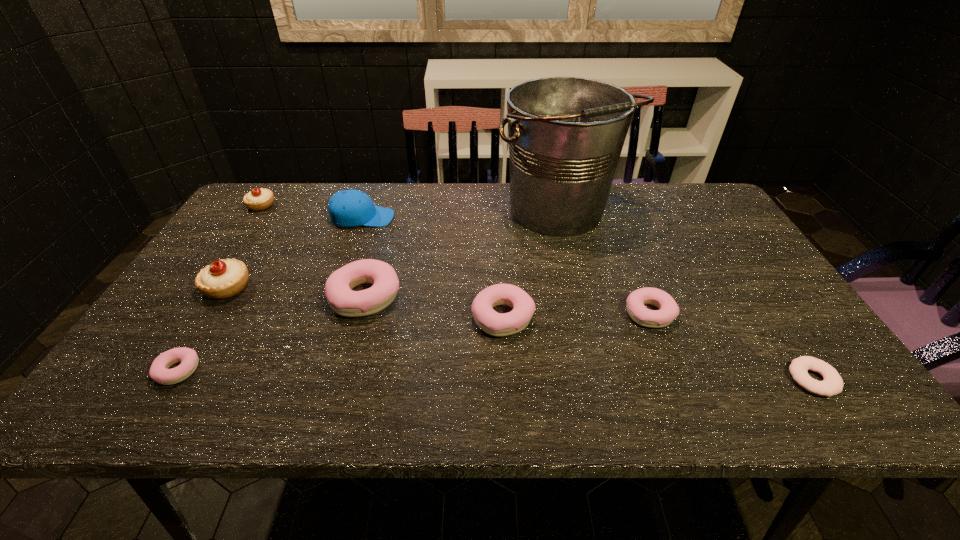
At what (x,y) coordinates should I click in order to perform the action: click on blank space that satisfies the following two spatial constraints: 1. on the back side of the tallest object; 2. on the right side of the bigger beige pastry. Please return your answer as a coordinate pair (x, y). The width and height of the screenshot is (960, 540). Looking at the image, I should click on (275, 212).